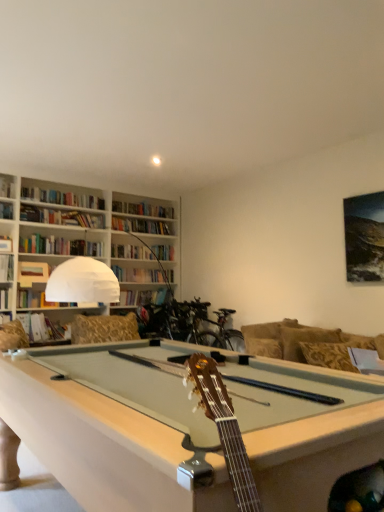
Question: Considering the relative sizes of gold-patterned fabric couch at right and hardcover book at left, positioned as the second book in top-to-bottom order, in the image provided, is gold-patterned fabric couch at right bigger than hardcover book at left, positioned as the second book in top-to-bottom order,?

Choices:
 (A) no
 (B) yes

Answer: (B)

Question: Is gold-patterned fabric couch at right further to camera compared to hardcover book at left, the third book ordered from the bottom?

Choices:
 (A) no
 (B) yes

Answer: (A)

Question: Does gold-patterned fabric couch at right have a lesser width compared to hardcover book at left, the third book ordered from the bottom?

Choices:
 (A) no
 (B) yes

Answer: (A)

Question: From the image's perspective, is gold-patterned fabric couch at right under hardcover book at left, the third book ordered from the bottom?

Choices:
 (A) no
 (B) yes

Answer: (B)

Question: Is hardcover book at left, positioned as the second book in top-to-bottom order, a part of gold-patterned fabric couch at right?

Choices:
 (A) no
 (B) yes

Answer: (A)

Question: In terms of width, does hardcover book at upper left, positioned as the fourth book in bottom-to-top order, look wider or thinner when compared to gold-patterned fabric couch at right?

Choices:
 (A) wide
 (B) thin

Answer: (B)

Question: Considering the positions of point (11, 181) and point (337, 332), is point (11, 181) closer or farther from the camera than point (337, 332)?

Choices:
 (A) closer
 (B) farther

Answer: (B)

Question: In terms of size, does hardcover book at upper left, which ranks as the first book in top-to-bottom order, appear bigger or smaller than gold-patterned fabric couch at right?

Choices:
 (A) big
 (B) small

Answer: (B)

Question: Do you think hardcover book at upper left, which ranks as the first book in top-to-bottom order, is within gold-patterned fabric couch at right, or outside of it?

Choices:
 (A) inside
 (B) outside

Answer: (B)

Question: Is point (311, 346) positioned closer to the camera than point (46, 263)?

Choices:
 (A) closer
 (B) farther

Answer: (A)

Question: Considering the positions of gold-patterned fabric couch at right and matte brown book at upper left, acting as the second book starting from the bottom, in the image, is gold-patterned fabric couch at right bigger or smaller than matte brown book at upper left, acting as the second book starting from the bottom,?

Choices:
 (A) small
 (B) big

Answer: (B)

Question: In terms of height, does gold-patterned fabric couch at right look taller or shorter compared to matte brown book at upper left, acting as the second book starting from the bottom?

Choices:
 (A) short
 (B) tall

Answer: (B)

Question: Is gold-patterned fabric couch at right situated inside matte brown book at upper left, placed as the 3th book when sorted from top to bottom, or outside?

Choices:
 (A) inside
 (B) outside

Answer: (B)

Question: Do you think matte brown book at upper left, acting as the second book starting from the bottom, is within white fabric pillow at right, or outside of it?

Choices:
 (A) outside
 (B) inside

Answer: (A)

Question: Considering the relative positions of matte brown book at upper left, acting as the second book starting from the bottom, and white fabric pillow at right in the image provided, is matte brown book at upper left, acting as the second book starting from the bottom, to the left or to the right of white fabric pillow at right?

Choices:
 (A) left
 (B) right

Answer: (A)